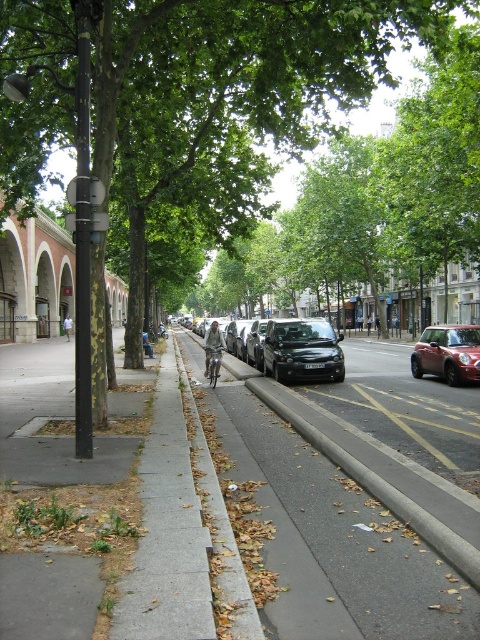
You are a pedestrian standing on the sidewalk looking towards the road. You see the dark gray asphalt at center and the metallic red car at right. Which object is closer to your left side?

The dark gray asphalt at center is closer to your left side because it is positioned to the left of the metallic red car at right from your perspective.

You are standing on the sidewalk in the European city street scene. There are two points marked on the ground in front of you. One is at coordinates point (237,54) and the other is at point (206,356). Which point is closer to your current position?

Point (237,54) is closer to the viewer than point (206,356), so the point at coordinates point (237,54) is closer to your current position.

You are a delivery person who needs to park your metallic red car at right on the dark gray asphalt at center. Can your car fit on the asphalt?

The dark gray asphalt at center is bigger than metallic red car at right, so yes, the metallic red car at right can fit on the dark gray asphalt at center.